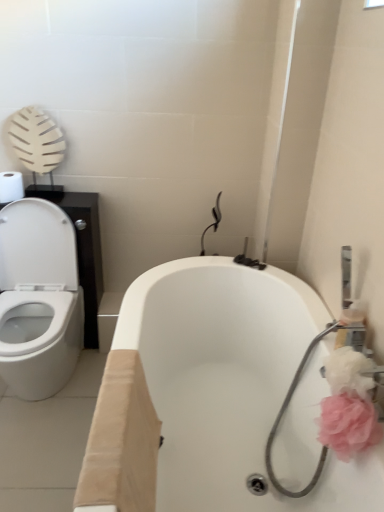
Question: Can you confirm if white glossy bathtub at center is bigger than white matte toilet paper at upper left?

Choices:
 (A) no
 (B) yes

Answer: (B)

Question: Is white glossy bathtub at center positioned with its back to white matte toilet paper at upper left?

Choices:
 (A) yes
 (B) no

Answer: (B)

Question: Is white glossy bathtub at center smaller than white matte toilet paper at upper left?

Choices:
 (A) yes
 (B) no

Answer: (B)

Question: Considering the relative sizes of white glossy bathtub at center and white matte toilet paper at upper left in the image provided, is white glossy bathtub at center thinner than white matte toilet paper at upper left?

Choices:
 (A) no
 (B) yes

Answer: (A)

Question: Does white glossy bathtub at center appear on the right side of white matte toilet paper at upper left?

Choices:
 (A) no
 (B) yes

Answer: (B)

Question: Does white glossy bathtub at center turn towards white matte toilet paper at upper left?

Choices:
 (A) no
 (B) yes

Answer: (A)

Question: Is white matte toilet paper at upper left positioned in front of white glossy bathtub at center?

Choices:
 (A) yes
 (B) no

Answer: (B)

Question: Is white matte toilet paper at upper left looking in the opposite direction of white glossy bathtub at center?

Choices:
 (A) yes
 (B) no

Answer: (B)

Question: From the image's perspective, would you say white matte toilet paper at upper left is shown under white glossy bathtub at center?

Choices:
 (A) yes
 (B) no

Answer: (B)

Question: Does white matte toilet paper at upper left have a lesser width compared to white glossy bathtub at center?

Choices:
 (A) no
 (B) yes

Answer: (B)

Question: Is white matte toilet paper at upper left to the right of white glossy bathtub at center from the viewer's perspective?

Choices:
 (A) no
 (B) yes

Answer: (A)

Question: Considering the relative sizes of white matte toilet paper at upper left and white glossy bathtub at center in the image provided, is white matte toilet paper at upper left smaller than white glossy bathtub at center?

Choices:
 (A) yes
 (B) no

Answer: (A)

Question: Considering the relative sizes of pink fluffy flower at right, acting as the second flower starting from the bottom, and white matte toilet paper at upper left in the image provided, is pink fluffy flower at right, acting as the second flower starting from the bottom, smaller than white matte toilet paper at upper left?

Choices:
 (A) yes
 (B) no

Answer: (A)